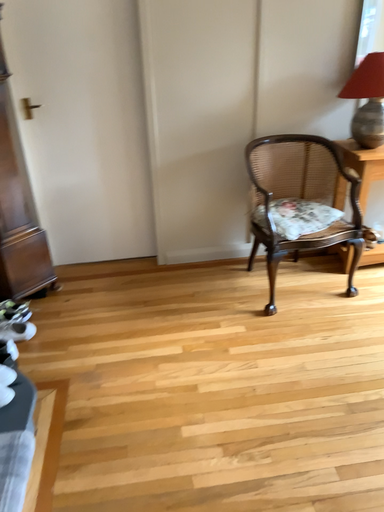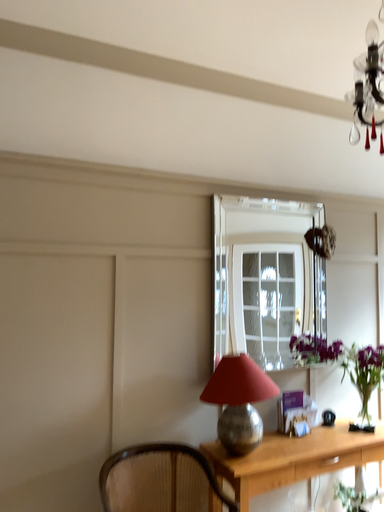
Question: Which way did the camera rotate in the video?

Choices:
 (A) rotated upward
 (B) rotated downward

Answer: (A)